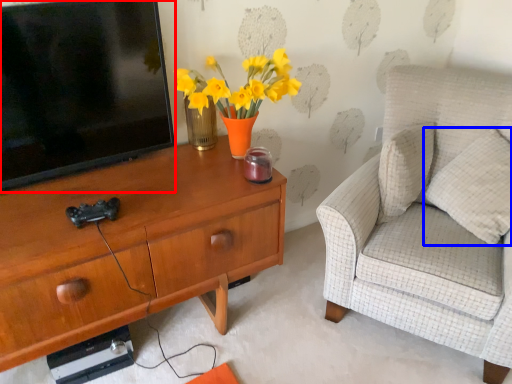
Question: Which point is further to the camera, television (highlighted by a red box) or pillow (highlighted by a blue box)?

Choices:
 (A) television
 (B) pillow

Answer: (B)